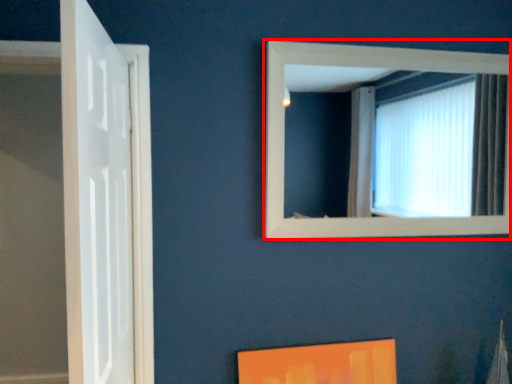
Question: Observing the image, what is the correct spatial positioning of window (annotated by the red box) in reference to door?

Choices:
 (A) right
 (B) left

Answer: (A)